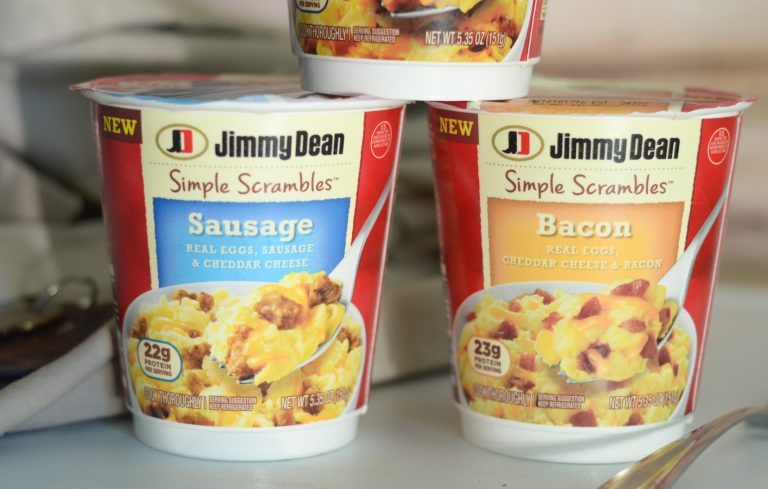
Image resolution: width=768 pixels, height=489 pixels. Find the location of `cup`. cup is located at coordinates (527, 29).